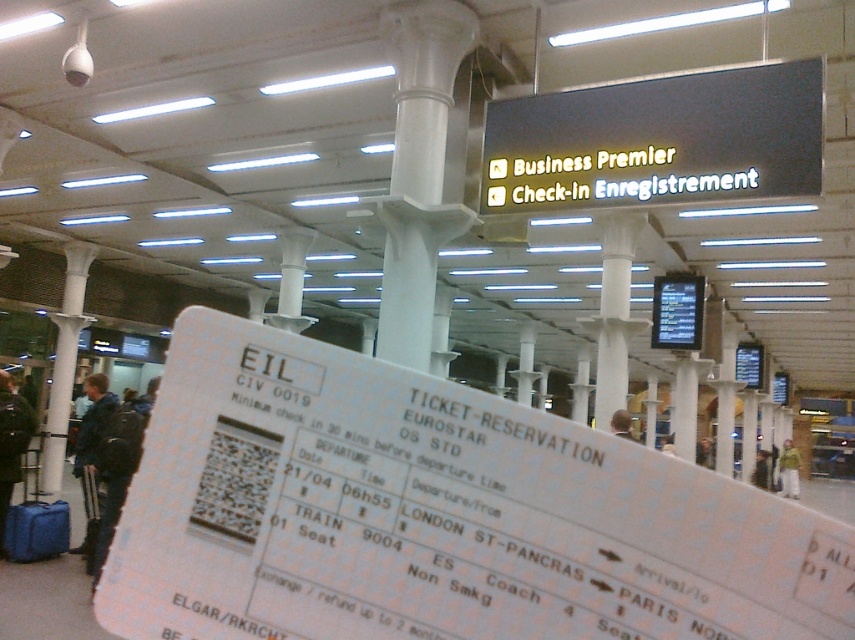
Question: Can you confirm if blue fabric suitcase at lower left is thinner than light brown hair at center?

Choices:
 (A) no
 (B) yes

Answer: (A)

Question: Which point is closer to the camera taking this photo?

Choices:
 (A) (628, 433)
 (B) (38, 556)

Answer: (B)

Question: Can you confirm if dark blue jacket at lower left is positioned to the right of dark blue jacket at left?

Choices:
 (A) no
 (B) yes

Answer: (A)

Question: Which object is positioned farthest from the dark blue jacket at lower left?

Choices:
 (A) dark blue jacket at left
 (B) blue fabric suitcase at lower left
 (C) light brown leather jacket at lower right
 (D) light brown hair at center

Answer: (C)

Question: Considering the real-world distances, which object is closest to the dark blue jacket at lower left?

Choices:
 (A) dark blue jacket at left
 (B) light brown hair at center
 (C) light brown leather jacket at lower right

Answer: (A)

Question: Is dark blue jacket at left positioned in front of green fuzzy jacket at lower right?

Choices:
 (A) yes
 (B) no

Answer: (A)